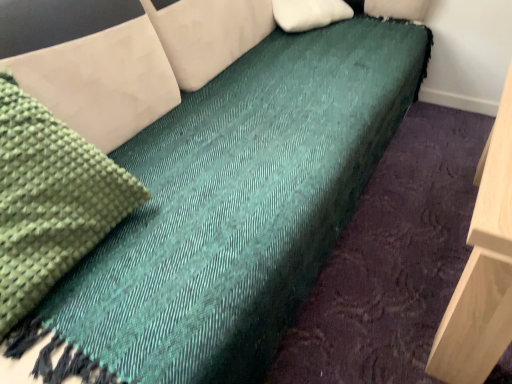
Question: In terms of height, does green knitted fabric at left look taller or shorter compared to white soft pillow at upper center?

Choices:
 (A) short
 (B) tall

Answer: (B)

Question: From the image's perspective, relative to white soft pillow at upper center, is green knitted fabric at left above or below?

Choices:
 (A) above
 (B) below

Answer: (B)

Question: Looking at the image, does green knitted fabric at left seem bigger or smaller compared to white soft pillow at upper center?

Choices:
 (A) small
 (B) big

Answer: (B)

Question: In terms of size, does white soft pillow at upper center appear bigger or smaller than green knitted fabric at left?

Choices:
 (A) small
 (B) big

Answer: (A)

Question: Is white soft pillow at upper center spatially inside green knitted fabric at left, or outside of it?

Choices:
 (A) inside
 (B) outside

Answer: (B)

Question: From the image's perspective, relative to green knitted fabric at left, is white soft pillow at upper center above or below?

Choices:
 (A) above
 (B) below

Answer: (A)

Question: In the image, is white soft pillow at upper center positioned in front of or behind green knitted fabric at left?

Choices:
 (A) behind
 (B) front

Answer: (A)